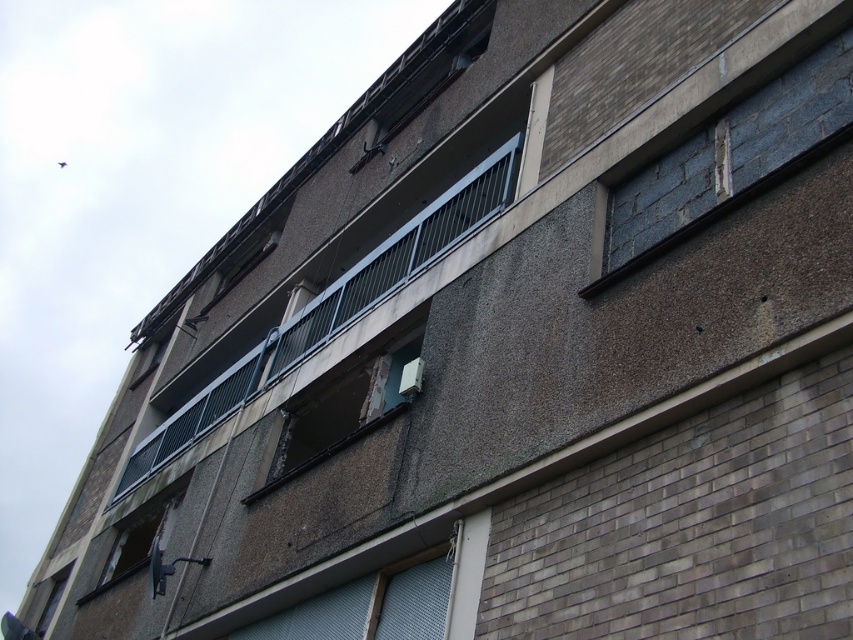
Measure the distance from rusty metal window at center to rusty metal window at lower left.

rusty metal window at center is 3.62 meters from rusty metal window at lower left.

Is rusty metal window at center shorter than rusty metal window at lower left?

No, rusty metal window at center is not shorter than rusty metal window at lower left.

Which is behind, point (343, 396) or point (114, 561)?

Positioned behind is point (114, 561).

The image size is (853, 640). Find the location of `rusty metal window at center`. rusty metal window at center is located at coordinates (335, 420).

Is blue concrete window at upper right bigger than rusty metal window at center?

Actually, blue concrete window at upper right might be smaller than rusty metal window at center.

Which of these two, blue concrete window at upper right or rusty metal window at center, stands taller?

With more height is rusty metal window at center.

Who is more distant from viewer, (735, 205) or (379, 412)?

The point (379, 412) is more distant.

Identify the location of blue concrete window at upper right. The image size is (853, 640). (730, 160).

Is blue concrete window at upper right wider than rusty metal window at lower left?

No.

Who is positioned more to the right, blue concrete window at upper right or rusty metal window at lower left?

Positioned to the right is blue concrete window at upper right.

Locate an element on the screen. This screenshot has height=640, width=853. blue concrete window at upper right is located at coordinates (730, 160).